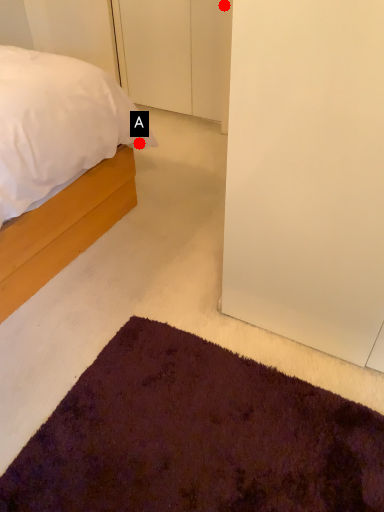
Question: Two points are circled on the image, labeled by A and B beside each circle. Which point is closer to the camera?

Choices:
 (A) A is closer
 (B) B is closer

Answer: (A)